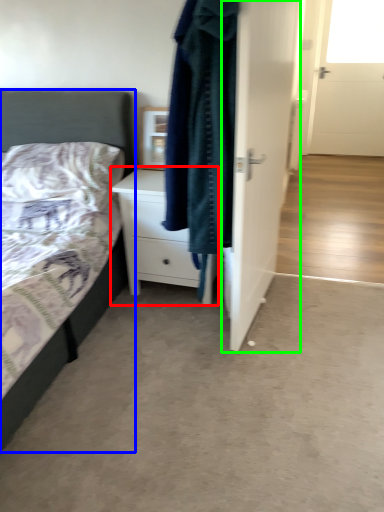
Question: Based on their relative distances, which object is nearer to chest of drawers (highlighted by a red box)? Choose from bed (highlighted by a blue box) and door (highlighted by a green box).

Choices:
 (A) bed
 (B) door

Answer: (A)